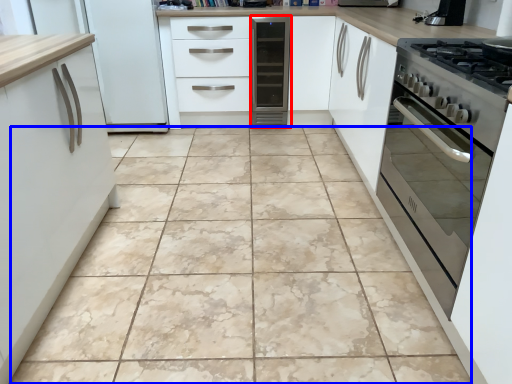
Question: Among these objects, which one is nearest to the camera, home appliance (highlighted by a red box) or ceramic tile (highlighted by a blue box)?

Choices:
 (A) home appliance
 (B) ceramic tile

Answer: (B)